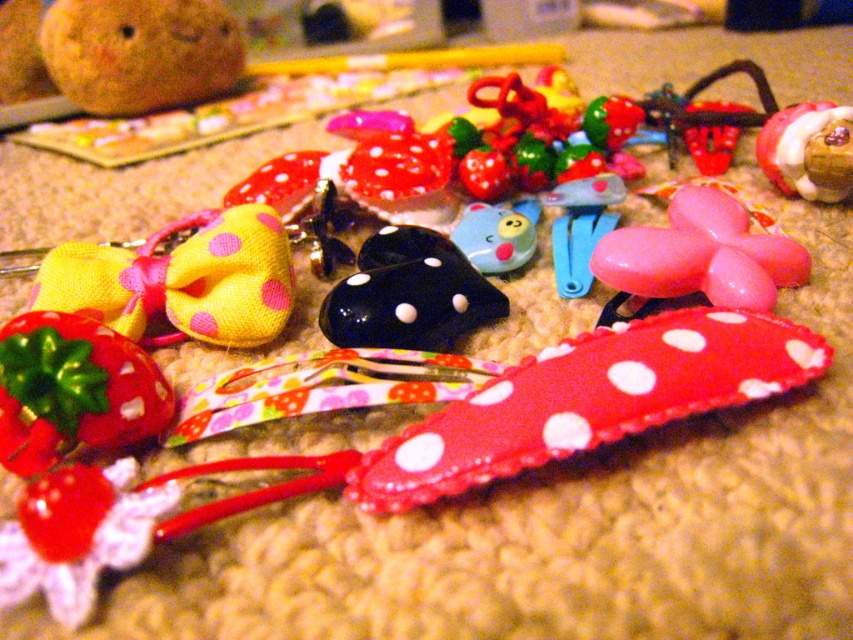
You are a child trying to reach for the black glossy heart at center and the blue rubber duck at center on the table. Which one is taller?

The black glossy heart at center is much taller than the blue rubber duck at center.

You are organizing hair accessories and need to place the yellow fabric bow at left and the blue plastic clip at center into a box. Based on their sizes, which one might require more space horizontally?

The yellow fabric bow at left might be wider than the blue plastic clip at center, so it would require more horizontal space.

You are organizing a hair accessory display and want to place the matte red fabric bow at upper left and the blue plastic clip at center on a shelf. If the shelf has limited space, which accessory should you place first to ensure both fit?

The matte red fabric bow at upper left is smaller than the blue plastic clip at center, so you should place the blue plastic clip at center first to ensure there is enough space for both.